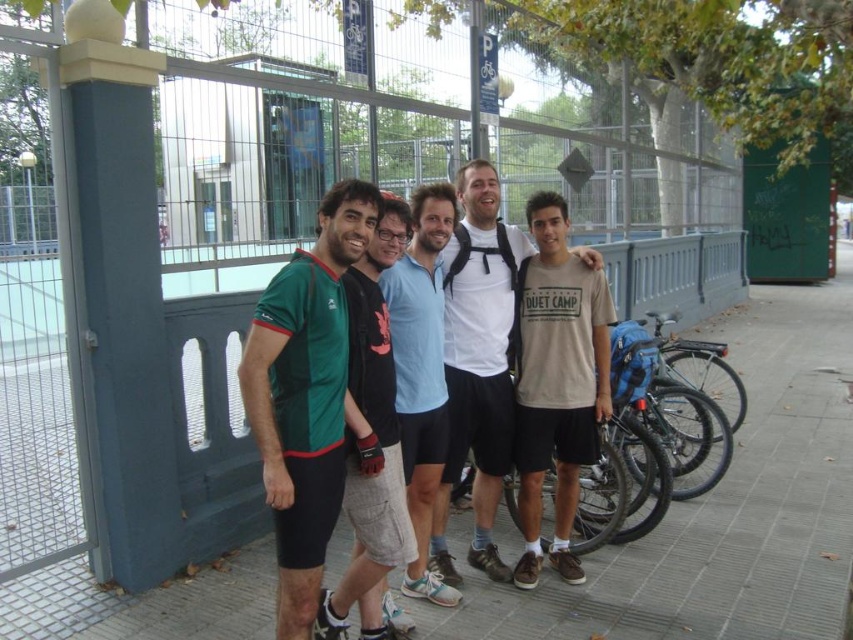
Question: Which point is closer to the camera?

Choices:
 (A) green matte jersey at center
 (B) gray concrete pavement at center

Answer: (A)

Question: Which point appears farthest from the camera in this image?

Choices:
 (A) (440, 369)
 (B) (73, 605)
 (C) (299, 500)

Answer: (B)

Question: Does green fabric shirt at center lie in front of light blue cotton shirt at center?

Choices:
 (A) no
 (B) yes

Answer: (B)

Question: Observing the image, what is the correct spatial positioning of white matte t-shirt at center in reference to light blue cotton shirt at center?

Choices:
 (A) left
 (B) right

Answer: (B)

Question: Can you confirm if green matte jersey at center is wider than white matte t-shirt at center?

Choices:
 (A) no
 (B) yes

Answer: (A)

Question: Which point is farther to the camera?

Choices:
 (A) green matte jersey at center
 (B) gray concrete pavement at center
 (C) green fabric shirt at center
 (D) white matte t-shirt at center

Answer: (D)